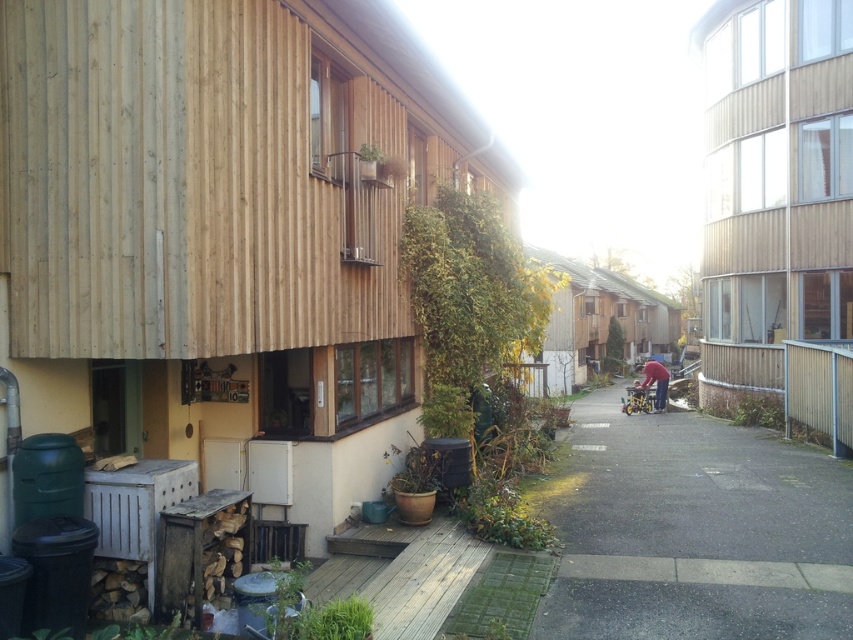
Question: Considering the real-world distances, which object is farthest from the smooth asphalt alley at center?

Choices:
 (A) pink fabric at center-right
 (B) metallic silver baby carriage at center-right

Answer: (B)

Question: Where is smooth asphalt alley at center located in relation to metallic silver baby carriage at center-right in the image?

Choices:
 (A) above
 (B) below

Answer: (A)

Question: Estimate the real-world distances between objects in this image. Which object is closer to the pink fabric at center-right?

Choices:
 (A) metallic silver baby carriage at center-right
 (B) smooth asphalt alley at center

Answer: (A)

Question: Can you confirm if smooth asphalt alley at center is positioned to the right of metallic silver baby carriage at center-right?

Choices:
 (A) no
 (B) yes

Answer: (A)

Question: In this image, where is smooth asphalt alley at center located relative to pink fabric at center-right?

Choices:
 (A) left
 (B) right

Answer: (A)

Question: Which point is closer to the camera?

Choices:
 (A) metallic silver baby carriage at center-right
 (B) smooth asphalt alley at center
 (C) pink fabric at center-right

Answer: (B)